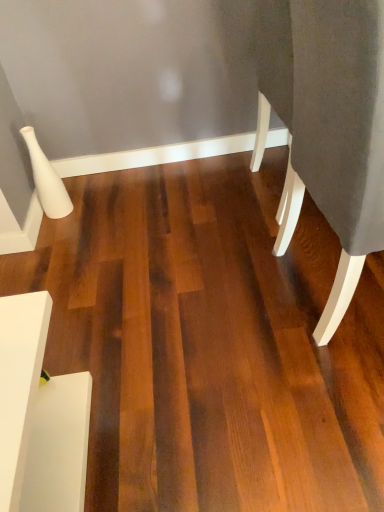
Question: From the image's perspective, is white matte side table at lower left, marked as the 1th furniture in a bottom-to-top arrangement, above or below dark gray fabric at right, the 2th furniture from the bottom?

Choices:
 (A) above
 (B) below

Answer: (B)

Question: In the image, is white matte side table at lower left, the second furniture positioned from the top, positioned in front of or behind dark gray fabric at right, marked as the first furniture in a right-to-left arrangement?

Choices:
 (A) front
 (B) behind

Answer: (B)

Question: Is white matte side table at lower left, marked as the 1th furniture in a bottom-to-top arrangement, spatially inside dark gray fabric at right, marked as the first furniture in a right-to-left arrangement, or outside of it?

Choices:
 (A) inside
 (B) outside

Answer: (B)

Question: Considering the positions of point (357, 147) and point (18, 375), is point (357, 147) closer or farther from the camera than point (18, 375)?

Choices:
 (A) farther
 (B) closer

Answer: (A)

Question: Visually, is dark gray fabric at right, marked as the first furniture in a right-to-left arrangement, positioned to the left or to the right of white matte side table at lower left, marked as the 1th furniture in a bottom-to-top arrangement?

Choices:
 (A) right
 (B) left

Answer: (A)

Question: From the image's perspective, relative to white matte side table at lower left, marked as the 1th furniture in a bottom-to-top arrangement, is dark gray fabric at right, marked as the first furniture in a top-to-bottom arrangement, above or below?

Choices:
 (A) below
 (B) above

Answer: (B)

Question: In terms of size, does dark gray fabric at right, the 2th furniture from the bottom, appear bigger or smaller than white matte side table at lower left, the second furniture positioned from the top?

Choices:
 (A) big
 (B) small

Answer: (A)